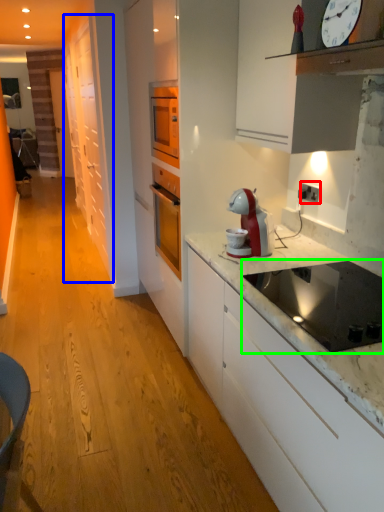
Question: Considering the real-world distances, which object is farthest from electric outlet (highlighted by a red box)? cabinetry (highlighted by a blue box) or kitchen appliance (highlighted by a green box)?

Choices:
 (A) cabinetry
 (B) kitchen appliance

Answer: (A)